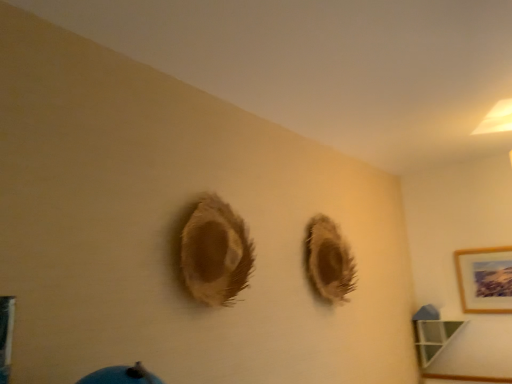
Question: Does point (452, 322) appear closer or farther from the camera than point (481, 261)?

Choices:
 (A) farther
 (B) closer

Answer: (A)

Question: Considering the positions of green glass shelf at lower right and wooden picture frame at upper right in the image, is green glass shelf at lower right bigger or smaller than wooden picture frame at upper right?

Choices:
 (A) small
 (B) big

Answer: (B)

Question: Which object is positioned closest to the wooden picture frame at upper right?

Choices:
 (A) green glass shelf at lower right
 (B) fuzzy brown hole at center

Answer: (A)

Question: Which is farther from the fuzzy brown hole at center?

Choices:
 (A) wooden picture frame at upper right
 (B) green glass shelf at lower right

Answer: (A)